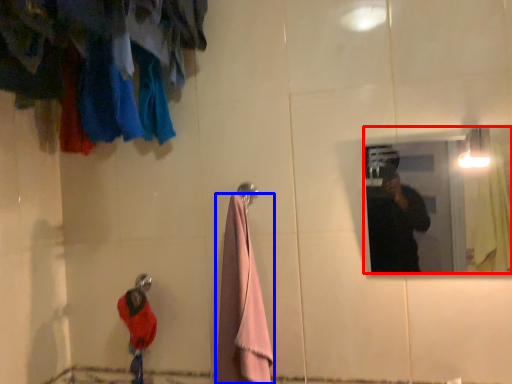
Question: Which point is closer to the camera, mirror (highlighted by a red box) or towel/napkin (highlighted by a blue box)?

Choices:
 (A) mirror
 (B) towel/napkin

Answer: (A)